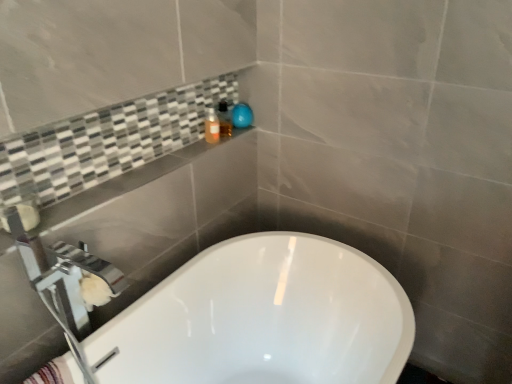
Question: Is matte orange bottle at upper center, which ranks as the first toiletry in left-to-right order, outside striped cotton bath towel at lower left?

Choices:
 (A) no
 (B) yes

Answer: (B)

Question: From a real-world perspective, is matte orange bottle at upper center, which is counted as the 2th toiletry, starting from the right, below striped cotton bath towel at lower left?

Choices:
 (A) no
 (B) yes

Answer: (A)

Question: From the image's perspective, would you say matte orange bottle at upper center, which ranks as the first toiletry in left-to-right order, is shown under striped cotton bath towel at lower left?

Choices:
 (A) no
 (B) yes

Answer: (A)

Question: Is matte orange bottle at upper center, which ranks as the first toiletry in left-to-right order, in front of striped cotton bath towel at lower left?

Choices:
 (A) yes
 (B) no

Answer: (B)

Question: Is matte orange bottle at upper center, which is counted as the 2th toiletry, starting from the right, positioned behind striped cotton bath towel at lower left?

Choices:
 (A) no
 (B) yes

Answer: (B)

Question: Can striped cotton bath towel at lower left be found inside matte orange bottle at upper center, which is counted as the 2th toiletry, starting from the right?

Choices:
 (A) no
 (B) yes

Answer: (A)

Question: From a real-world perspective, is translucent plastic soap dispenser at upper center, marked as the second toiletry in a left-to-right arrangement, positioned over silver metallic faucet at lower left based on gravity?

Choices:
 (A) yes
 (B) no

Answer: (A)

Question: Is translucent plastic soap dispenser at upper center, marked as the second toiletry in a left-to-right arrangement, not inside silver metallic faucet at lower left?

Choices:
 (A) no
 (B) yes

Answer: (B)

Question: From the image's perspective, is translucent plastic soap dispenser at upper center, the first toiletry positioned from the right, above silver metallic faucet at lower left?

Choices:
 (A) yes
 (B) no

Answer: (A)

Question: Is translucent plastic soap dispenser at upper center, the first toiletry positioned from the right, oriented towards silver metallic faucet at lower left?

Choices:
 (A) no
 (B) yes

Answer: (A)

Question: Is translucent plastic soap dispenser at upper center, the first toiletry positioned from the right, closer to camera compared to silver metallic faucet at lower left?

Choices:
 (A) no
 (B) yes

Answer: (A)

Question: Is translucent plastic soap dispenser at upper center, the first toiletry positioned from the right, looking in the opposite direction of silver metallic faucet at lower left?

Choices:
 (A) no
 (B) yes

Answer: (A)

Question: Could you tell me if translucent plastic soap dispenser at upper center, marked as the second toiletry in a left-to-right arrangement, is turned towards chrome metallic tap at upper left?

Choices:
 (A) no
 (B) yes

Answer: (A)